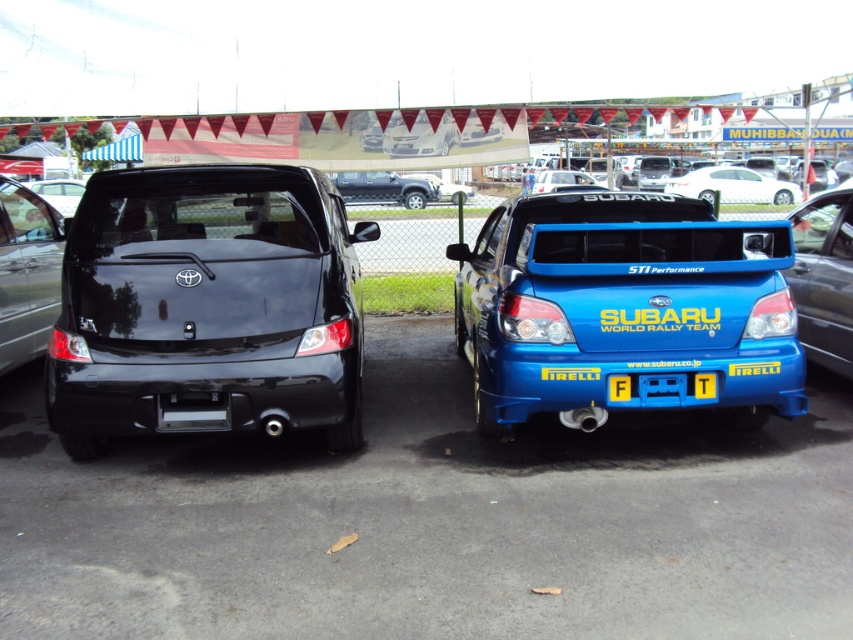
Question: Can you confirm if blue glossy sedan at right is wider than white glossy sedan at upper center?

Choices:
 (A) no
 (B) yes

Answer: (A)

Question: Among these points, which one is farthest from the camera?

Choices:
 (A) (1, 236)
 (B) (798, 298)
 (C) (712, 195)
 (D) (735, 292)

Answer: (C)

Question: Can you confirm if glossy black sedan at left is thinner than white glossy sedan at upper center?

Choices:
 (A) no
 (B) yes

Answer: (B)

Question: Which point is closer to the camera?

Choices:
 (A) (212, 326)
 (B) (33, 356)
 (C) (830, 246)

Answer: (A)

Question: Among these objects, which one is farthest from the camera?

Choices:
 (A) glossy black sedan at left
 (B) white glossy sedan at upper center

Answer: (B)

Question: In this image, where is black glossy minivan at left located relative to blue glossy sedan at right?

Choices:
 (A) above
 (B) below

Answer: (B)